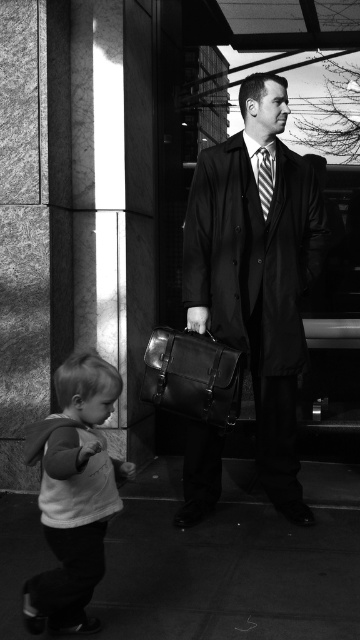
Can you confirm if matte black coat at center is wider than leather briefcase at center?

Yes.

Is matte black coat at center closer to camera compared to leather briefcase at center?

No, it is not.

Where is `matte black coat at center`? matte black coat at center is located at coordinates (258, 273).

Where is `matte black coat at center`? This screenshot has height=640, width=360. matte black coat at center is located at coordinates (258, 273).

Can you confirm if white soft shirt at lower left is positioned to the left of striped fabric tie at center?

Yes, white soft shirt at lower left is to the left of striped fabric tie at center.

Is point (77, 481) closer to camera compared to point (268, 172)?

Yes, it is.

Image resolution: width=360 pixels, height=640 pixels. Find the location of `white soft shirt at lower left`. white soft shirt at lower left is located at coordinates (74, 493).

Can you confirm if smooth concrete pavement at lower center is wider than matte black coat at center?

Indeed, smooth concrete pavement at lower center has a greater width compared to matte black coat at center.

Is smooth concrete pavement at lower center shorter than matte black coat at center?

Indeed, smooth concrete pavement at lower center has a lesser height compared to matte black coat at center.

Is point (227, 502) positioned after point (263, 246)?

Yes.

Locate an element on the screen. smooth concrete pavement at lower center is located at coordinates (232, 561).